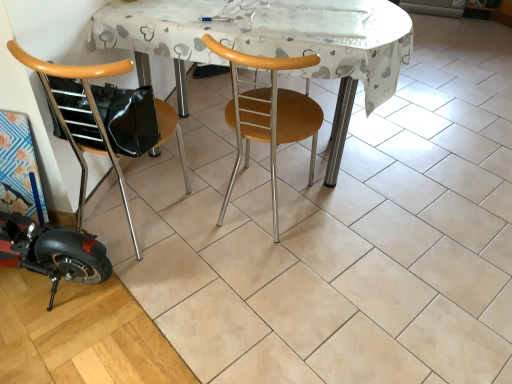
Question: Is white plastic table at center located outside woodenchair at left, positioned as the 2th chair in right-to-left order?

Choices:
 (A) no
 (B) yes

Answer: (B)

Question: Is the depth of white plastic table at center greater than that of woodenchair at left, positioned as the 2th chair in right-to-left order?

Choices:
 (A) no
 (B) yes

Answer: (B)

Question: Can you confirm if white plastic table at center is shorter than woodenchair at left, positioned as the 2th chair in right-to-left order?

Choices:
 (A) no
 (B) yes

Answer: (B)

Question: Can you see white plastic table at center touching woodenchair at left, positioned as the first chair in left-to-right order?

Choices:
 (A) yes
 (B) no

Answer: (B)

Question: Is white plastic table at center closer to camera compared to woodenchair at left, positioned as the first chair in left-to-right order?

Choices:
 (A) no
 (B) yes

Answer: (A)

Question: Is woodenchair at left, positioned as the 2th chair in right-to-left order, completely or partially inside white plastic table at center?

Choices:
 (A) no
 (B) yes

Answer: (A)

Question: Considering the relative positions of white plastic table at center and woodenwoodenchair at center, which is the first chair from right to left, in the image provided, is white plastic table at center to the left of woodenwoodenchair at center, which is the first chair from right to left, from the viewer's perspective?

Choices:
 (A) yes
 (B) no

Answer: (B)

Question: Does white plastic table at center have a greater width compared to woodenwoodenchair at center, which is the first chair from right to left?

Choices:
 (A) no
 (B) yes

Answer: (B)

Question: Is white plastic table at center bigger than woodenwoodenchair at center, which is the first chair from right to left?

Choices:
 (A) yes
 (B) no

Answer: (A)

Question: From a real-world perspective, is white plastic table at center below woodenwoodenchair at center, which is the first chair from right to left?

Choices:
 (A) yes
 (B) no

Answer: (A)

Question: From the image's perspective, is white plastic table at center under woodenwoodenchair at center, which is the first chair from right to left?

Choices:
 (A) yes
 (B) no

Answer: (B)

Question: Would you consider white plastic table at center to be distant from woodenwoodenchair at center, which is the first chair from right to left?

Choices:
 (A) yes
 (B) no

Answer: (B)

Question: From a real-world perspective, is woodenwoodenchair at center, which ranks as the second chair in left-to-right order, beneath woodenchair at left, positioned as the 2th chair in right-to-left order?

Choices:
 (A) no
 (B) yes

Answer: (B)